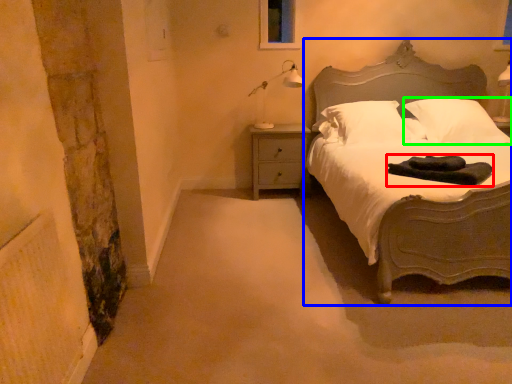
Question: Based on their relative distances, which object is nearer to material (highlighted by a red box)? Choose from bed (highlighted by a blue box) and pillow (highlighted by a green box).

Choices:
 (A) bed
 (B) pillow

Answer: (B)